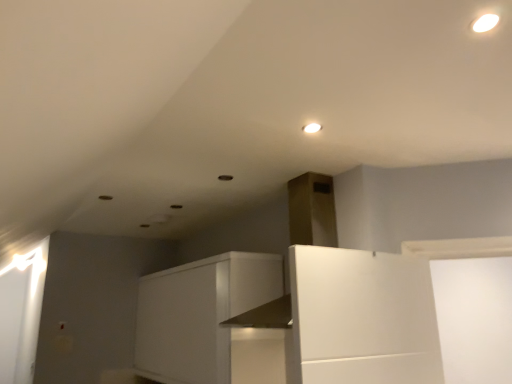
In order to face white matte cabinet at center, should I rotate leftwards or rightwards?

It's best to rotate left around 7.924 degrees.

In order to click on white matte cabinet at center in this screenshot , I will do `click(200, 314)`.

What do you see at coordinates (200, 314) in the screenshot? I see `white matte cabinet at center` at bounding box center [200, 314].

This screenshot has height=384, width=512. Find the location of `matte white light fixture at upper center`. matte white light fixture at upper center is located at coordinates (312, 128).

Measure the distance between point (x=318, y=127) and camera.

Point (x=318, y=127) is 1.66 meters away from camera.

This screenshot has width=512, height=384. What do you see at coordinates (312, 128) in the screenshot?
I see `matte white light fixture at upper center` at bounding box center [312, 128].

At what (x,y) coordinates should I click in order to perform the action: click on white matte cabinet at center. Please return your answer as a coordinate pair (x, y). Image resolution: width=512 pixels, height=384 pixels. Looking at the image, I should click on coord(200,314).

Which object is positioned more to the left, matte white light fixture at upper center or white matte cabinet at center?

white matte cabinet at center is more to the left.

Between matte white light fixture at upper center and white matte cabinet at center, which one is positioned behind?

white matte cabinet at center is behind.

Does point (311, 131) appear closer or farther from the camera than point (208, 359)?

Point (311, 131).

From the image's perspective, relative to white matte cabinet at center, is matte white light fixture at upper center above or below?

matte white light fixture at upper center is situated higher than white matte cabinet at center in the image.

From a real-world perspective, is matte white light fixture at upper center beneath white matte cabinet at center?

No, from a real-world perspective, matte white light fixture at upper center is not under white matte cabinet at center.

Considering the relative sizes of matte white light fixture at upper center and white matte cabinet at center in the image provided, is matte white light fixture at upper center thinner than white matte cabinet at center?

Yes.

Looking at this image, considering the relative sizes of matte white light fixture at upper center and white matte cabinet at center in the image provided, is matte white light fixture at upper center taller than white matte cabinet at center?

In fact, matte white light fixture at upper center may be shorter than white matte cabinet at center.

Does matte white light fixture at upper center have a smaller size compared to white matte cabinet at center?

Indeed, matte white light fixture at upper center has a smaller size compared to white matte cabinet at center.

Does matte white light fixture at upper center contain white matte cabinet at center?

No, white matte cabinet at center is not surrounded by matte white light fixture at upper center.

Would you say matte white light fixture at upper center is a long distance from white matte cabinet at center?

Yes, matte white light fixture at upper center and white matte cabinet at center are quite far apart.

Is matte white light fixture at upper center turned away from white matte cabinet at center?

No, matte white light fixture at upper center is not facing away from white matte cabinet at center.

How different are the orientations of matte white light fixture at upper center and white matte cabinet at center in degrees?

There is a 88.4-degree angle between the facing directions of matte white light fixture at upper center and white matte cabinet at center.

Measure the distance between matte white light fixture at upper center and white matte cabinet at center.

matte white light fixture at upper center is 1.72 meters away from white matte cabinet at center.

You are a GUI agent. You are given a task and a screenshot of the screen. Output one action in this format:
    pyautogui.click(x=<x>, y=<y>)
    Task: Click on the cabinetry that appears below the matte white light fixture at upper center (from the image's perspective)
    The height and width of the screenshot is (384, 512).
    Given the screenshot: What is the action you would take?
    pyautogui.click(x=200, y=314)

Which object is positioned more to the left, white matte cabinet at center or matte white light fixture at upper center?

white matte cabinet at center.

Is white matte cabinet at center closer to the viewer compared to matte white light fixture at upper center?

That is False.

Considering the points (191, 266) and (315, 124), which point is behind, point (191, 266) or point (315, 124)?

The point (191, 266) is behind.

From the image's perspective, which one is positioned lower, white matte cabinet at center or matte white light fixture at upper center?

white matte cabinet at center.

From a real-world perspective, is white matte cabinet at center beneath matte white light fixture at upper center?

Indeed, from a real-world perspective, white matte cabinet at center is positioned beneath matte white light fixture at upper center.

Considering the sizes of objects white matte cabinet at center and matte white light fixture at upper center in the image provided, who is wider, white matte cabinet at center or matte white light fixture at upper center?

white matte cabinet at center is wider.

Considering the sizes of objects white matte cabinet at center and matte white light fixture at upper center in the image provided, who is shorter, white matte cabinet at center or matte white light fixture at upper center?

matte white light fixture at upper center is shorter.

Who is smaller, white matte cabinet at center or matte white light fixture at upper center?

matte white light fixture at upper center.

Is white matte cabinet at center not inside matte white light fixture at upper center?

Indeed, white matte cabinet at center is completely outside matte white light fixture at upper center.

Are white matte cabinet at center and matte white light fixture at upper center making contact?

They are not placed beside each other.

Is white matte cabinet at center facing towards matte white light fixture at upper center?

No, white matte cabinet at center is not facing towards matte white light fixture at upper center.

How different are the orientations of white matte cabinet at center and matte white light fixture at upper center in degrees?

There is a 88.4-degree angle between the facing directions of white matte cabinet at center and matte white light fixture at upper center.

Where is `cabinetry lying behind the matte white light fixture at upper center`? The width and height of the screenshot is (512, 384). cabinetry lying behind the matte white light fixture at upper center is located at coordinates (200, 314).

Locate an element on the screen. cabinetry directly beneath the matte white light fixture at upper center (from a real-world perspective) is located at coordinates (200, 314).

Identify the location of lighting located on the right of white matte cabinet at center. (312, 128).